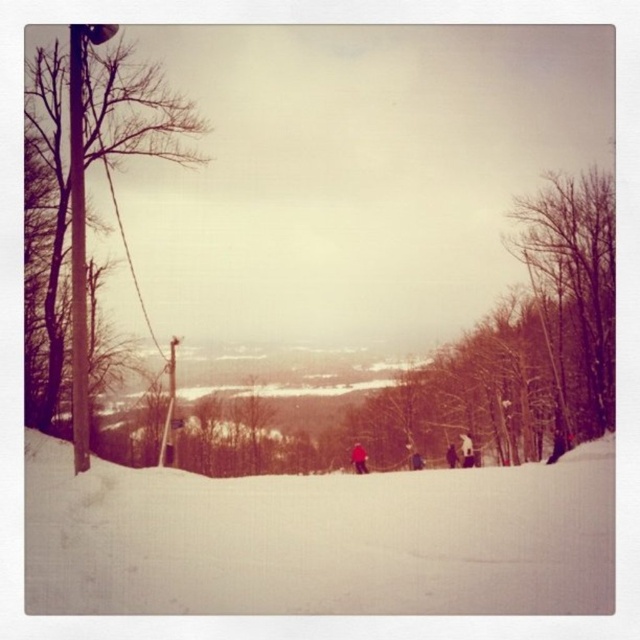
Does white snow at center appear on the left side of bare branches at right?

Correct, you'll find white snow at center to the left of bare branches at right.

Is point (358, 570) farther from camera compared to point (595, 237)?

No, (358, 570) is closer to viewer.

The height and width of the screenshot is (640, 640). What are the coordinates of `white snow at center` in the screenshot? It's located at (317, 538).

Is bare wood pole at left thinner than bare branches at right?

Incorrect, bare wood pole at left's width is not less than bare branches at right's.

Between bare wood pole at left and bare branches at right, which one is positioned lower?

bare branches at right

You are a GUI agent. You are given a task and a screenshot of the screen. Output one action in this format:
    pyautogui.click(x=<x>, y=<y>)
    Task: Click on the bare wood pole at left
    The width and height of the screenshot is (640, 640).
    Given the screenshot: What is the action you would take?
    pyautogui.click(x=90, y=163)

You are a GUI agent. You are given a task and a screenshot of the screen. Output one action in this format:
    pyautogui.click(x=<x>, y=<y>)
    Task: Click on the bare wood pole at left
    
    Given the screenshot: What is the action you would take?
    pyautogui.click(x=90, y=163)

In the scene shown: Who is more forward, [86,536] or [83,216]?

Point [86,536] is more forward.

Does white snow at center have a lesser width compared to bare wood pole at left?

In fact, white snow at center might be wider than bare wood pole at left.

What do you see at coordinates (317, 538) in the screenshot?
I see `white snow at center` at bounding box center [317, 538].

Where is `white snow at center`? The height and width of the screenshot is (640, 640). white snow at center is located at coordinates click(x=317, y=538).